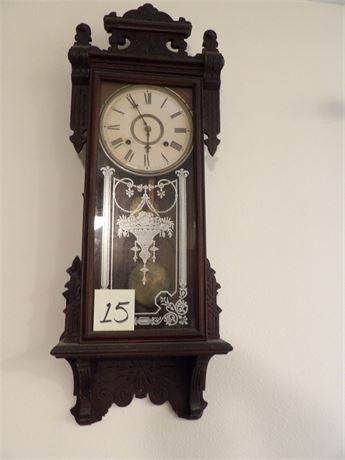
I want to click on clock, so click(157, 150).